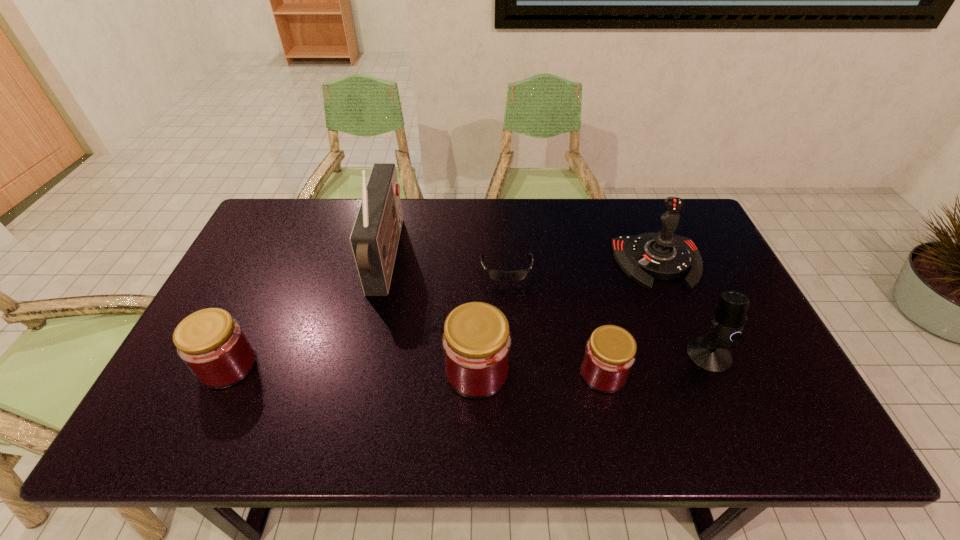
Please point a spot to place another jam for symmetrical spacing. Please provide its 2D coordinates. Your answer should be formatted as a tuple, i.e. [(x, y)], where the tuple contains the x and y coordinates of a point satisfying the conditions above.

[(352, 368)]